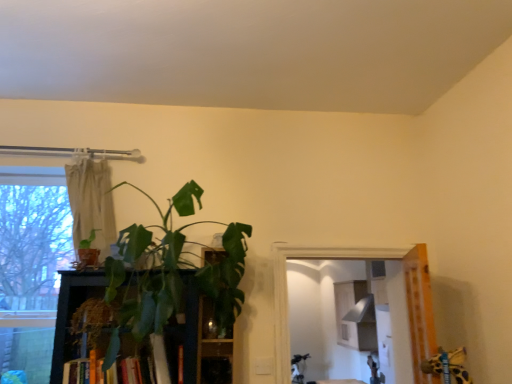
Question: Would you say green leafy plant at center, which is the 2th houseplant from left to right, is to the left or to the right of beige fabric curtain at upper left in the picture?

Choices:
 (A) right
 (B) left

Answer: (A)

Question: Is green leafy plant at center, which is the 2th houseplant from left to right, taller or shorter than beige fabric curtain at upper left?

Choices:
 (A) short
 (B) tall

Answer: (B)

Question: Which object is the closest to the beige fabric curtain at upper left?

Choices:
 (A) green leafy plant at center, which is the first houseplant in right-to-left order
 (B) hardcover book at center
 (C) green matte plant at left, the 2th houseplant positioned from the right
 (D) green leafy plant at center

Answer: (C)

Question: Which is nearer to the beige fabric curtain at upper left?

Choices:
 (A) hardcover book at center
 (B) green leafy plant at center, which is the 2th houseplant from left to right
 (C) green leafy plant at center
 (D) green matte plant at left, positioned as the first houseplant in left-to-right order

Answer: (D)